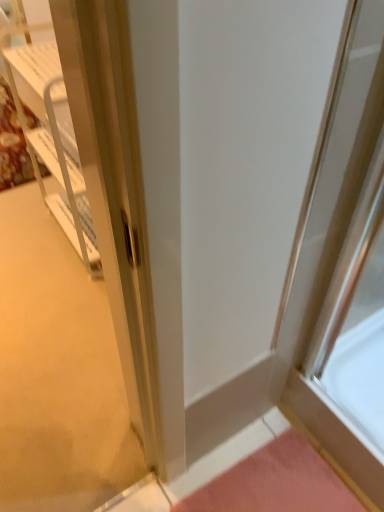
What do you see at coordinates (50, 138) in the screenshot? This screenshot has width=384, height=512. I see `white plastic cabinet at left` at bounding box center [50, 138].

Find the location of a particular element. white plastic cabinet at left is located at coordinates (50, 138).

Where is `pink fabric doormat at lower right`? pink fabric doormat at lower right is located at coordinates (275, 483).

What do you see at coordinates (275, 483) in the screenshot?
I see `pink fabric doormat at lower right` at bounding box center [275, 483].

I want to click on white plastic cabinet at left, so [x=50, y=138].

Looking at this image, which object is positioned more to the left, white plastic cabinet at left or pink fabric doormat at lower right?

From the viewer's perspective, white plastic cabinet at left appears more on the left side.

Which object is closer to the camera, white plastic cabinet at left or pink fabric doormat at lower right?

pink fabric doormat at lower right is closer to the camera.

Considering the points (34, 78) and (267, 504), which point is in front, point (34, 78) or point (267, 504)?

The point (267, 504) is closer.

From the image's perspective, is white plastic cabinet at left below pink fabric doormat at lower right?

Actually, white plastic cabinet at left appears above pink fabric doormat at lower right in the image.

From a real-world perspective, relative to pink fabric doormat at lower right, is white plastic cabinet at left vertically above or below?

From a real-world perspective, white plastic cabinet at left is physically above pink fabric doormat at lower right.

Based on the photo, which object is wider, white plastic cabinet at left or pink fabric doormat at lower right?

Wider between the two is pink fabric doormat at lower right.

Can you confirm if white plastic cabinet at left is taller than pink fabric doormat at lower right?

Yes, white plastic cabinet at left is taller than pink fabric doormat at lower right.

In the scene shown: Does white plastic cabinet at left have a larger size compared to pink fabric doormat at lower right?

Correct, white plastic cabinet at left is larger in size than pink fabric doormat at lower right.

Is white plastic cabinet at left not inside pink fabric doormat at lower right?

That's correct, white plastic cabinet at left is outside of pink fabric doormat at lower right.

Would you say white plastic cabinet at left is a long distance from pink fabric doormat at lower right?

Absolutely, white plastic cabinet at left is distant from pink fabric doormat at lower right.

Is white plastic cabinet at left aimed at pink fabric doormat at lower right?

No, white plastic cabinet at left does not turn towards pink fabric doormat at lower right.

Based on the photo, what's the angular difference between white plastic cabinet at left and pink fabric doormat at lower right's facing directions?

2.98 degrees separate the facing orientations of white plastic cabinet at left and pink fabric doormat at lower right.

Where is `cabinetry that is above the pink fabric doormat at lower right (from a real-world perspective)`? The image size is (384, 512). cabinetry that is above the pink fabric doormat at lower right (from a real-world perspective) is located at coordinates (50, 138).

Is pink fabric doormat at lower right to the right of white plastic cabinet at left from the viewer's perspective?

Correct, you'll find pink fabric doormat at lower right to the right of white plastic cabinet at left.

Does pink fabric doormat at lower right lie in front of white plastic cabinet at left?

Yes, it is in front of white plastic cabinet at left.

Which point is more forward, (x=233, y=497) or (x=37, y=175)?

The point (x=233, y=497) is closer.

From the image's perspective, which one is positioned higher, pink fabric doormat at lower right or white plastic cabinet at left?

white plastic cabinet at left is shown above in the image.

From a real-world perspective, relative to white plastic cabinet at left, is pink fabric doormat at lower right vertically above or below?

In terms of real-world spatial position, pink fabric doormat at lower right is below white plastic cabinet at left.

From the picture: Is pink fabric doormat at lower right thinner than white plastic cabinet at left?

No, pink fabric doormat at lower right is not thinner than white plastic cabinet at left.

Considering the relative sizes of pink fabric doormat at lower right and white plastic cabinet at left in the image provided, is pink fabric doormat at lower right taller than white plastic cabinet at left?

No.

From the picture: Does pink fabric doormat at lower right have a smaller size compared to white plastic cabinet at left?

Yes.

Is white plastic cabinet at left completely or partially inside pink fabric doormat at lower right?

No.

Is pink fabric doormat at lower right positioned far away from white plastic cabinet at left?

Yes, pink fabric doormat at lower right and white plastic cabinet at left are quite far apart.

Does pink fabric doormat at lower right turn towards white plastic cabinet at left?

No, pink fabric doormat at lower right is not aimed at white plastic cabinet at left.

What's the angular difference between pink fabric doormat at lower right and white plastic cabinet at left's facing directions?

pink fabric doormat at lower right and white plastic cabinet at left are facing 2.98 degrees away from each other.

Where is `cabinetry on the left of pink fabric doormat at lower right`? The image size is (384, 512). cabinetry on the left of pink fabric doormat at lower right is located at coordinates (50, 138).

The width and height of the screenshot is (384, 512). What are the coordinates of `doormat below the white plastic cabinet at left (from the image's perspective)` in the screenshot? It's located at (275, 483).

Where is `cabinetry above the pink fabric doormat at lower right (from the image's perspective)`? Image resolution: width=384 pixels, height=512 pixels. cabinetry above the pink fabric doormat at lower right (from the image's perspective) is located at coordinates (50, 138).